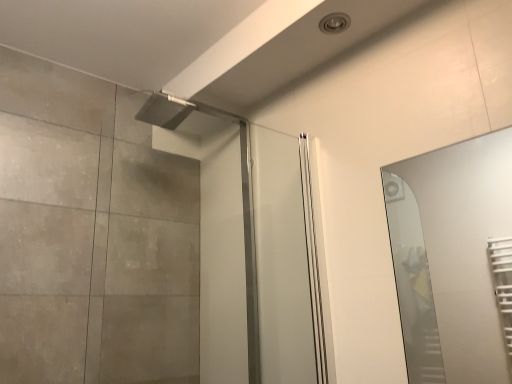
Question: Is clear glass screen door at upper center wider or thinner than clear glass mirror at right?

Choices:
 (A) thin
 (B) wide

Answer: (B)

Question: Based on their positions, is clear glass screen door at upper center located to the left or right of clear glass mirror at right?

Choices:
 (A) right
 (B) left

Answer: (B)

Question: In the image, is clear glass screen door at upper center positioned in front of or behind clear glass mirror at right?

Choices:
 (A) behind
 (B) front

Answer: (A)

Question: Relative to clear glass screen door at upper center, is clear glass mirror at right in front or behind?

Choices:
 (A) behind
 (B) front

Answer: (B)

Question: Is clear glass mirror at right taller or shorter than clear glass screen door at upper center?

Choices:
 (A) tall
 (B) short

Answer: (B)

Question: Is point (495, 142) positioned closer to the camera than point (268, 211)?

Choices:
 (A) closer
 (B) farther

Answer: (B)

Question: From a real-world perspective, relative to clear glass screen door at upper center, is clear glass mirror at right vertically above or below?

Choices:
 (A) above
 (B) below

Answer: (B)